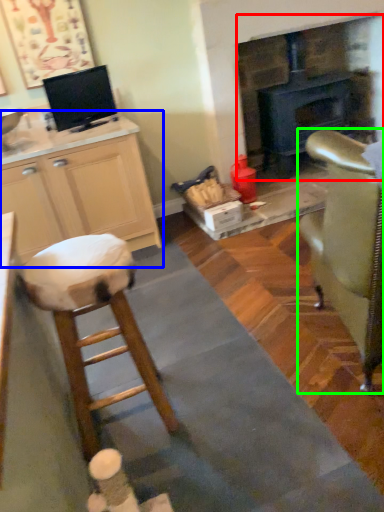
Question: Estimate the real-world distances between objects in this image. Which object is closer to fireplace (highlighted by a red box), cabinetry (highlighted by a blue box) or chair (highlighted by a green box)?

Choices:
 (A) cabinetry
 (B) chair

Answer: (A)